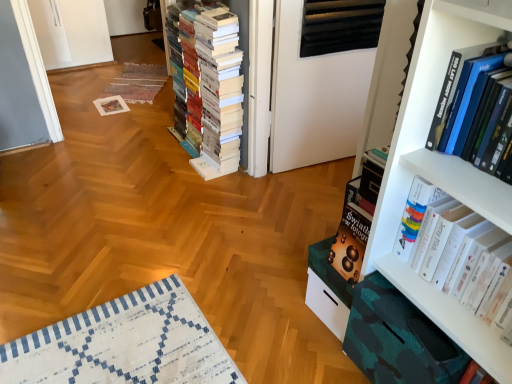
At what (x,y) coordinates should I click in order to perform the action: click on free space between white matte book at center, acting as the first book starting from the left, and white matte bookcase at right. Please return your answer as a coordinate pair (x, y). Looking at the image, I should click on (257, 205).